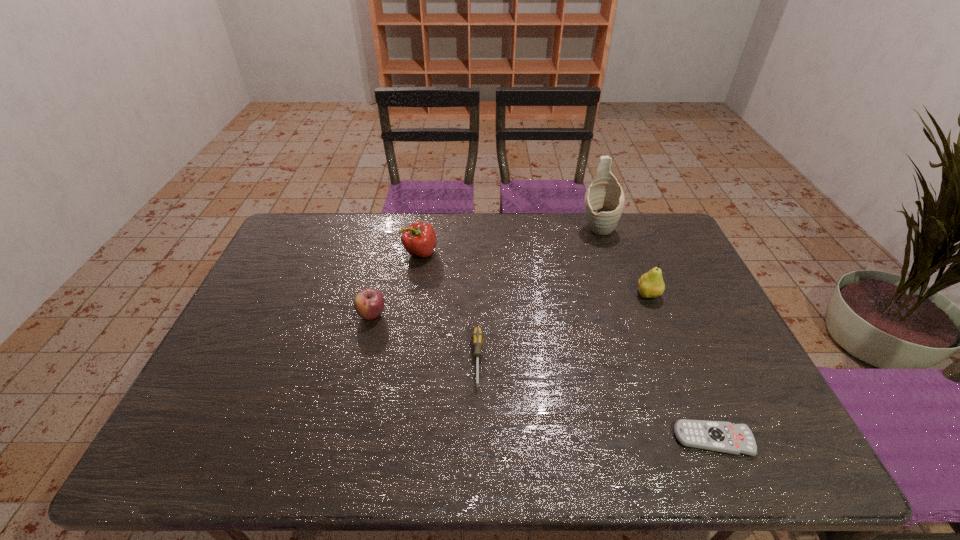
Locate an element on the screen. The image size is (960, 540). remote control is located at coordinates click(x=718, y=436).

At what (x,y) coordinates should I click in order to perform the action: click on free point located at the spout of the pitcher. Please return your answer as a coordinate pair (x, y). This screenshot has width=960, height=540. Looking at the image, I should click on (629, 323).

Identify the location of vacant region located 0.130m on the left of the pear. The height and width of the screenshot is (540, 960). [x=593, y=295].

The width and height of the screenshot is (960, 540). Identify the location of vacant area situated 0.130m on the left of the second farthest object. (365, 253).

Where is `free space located 0.080m on the right of the apple`? This screenshot has height=540, width=960. free space located 0.080m on the right of the apple is located at coordinates (414, 315).

This screenshot has width=960, height=540. Find the location of `vacant area situated at the tip of the second shortest object`. vacant area situated at the tip of the second shortest object is located at coordinates (477, 429).

In order to click on vacant space located 0.390m on the back of the remote control in this screenshot , I will do (657, 302).

This screenshot has height=540, width=960. I want to click on pitcher located in the far edge section of the desktop, so (604, 200).

The width and height of the screenshot is (960, 540). I want to click on pepper that is positioned at the far edge, so click(419, 239).

Image resolution: width=960 pixels, height=540 pixels. Identify the location of object that is at the near edge. (718, 436).